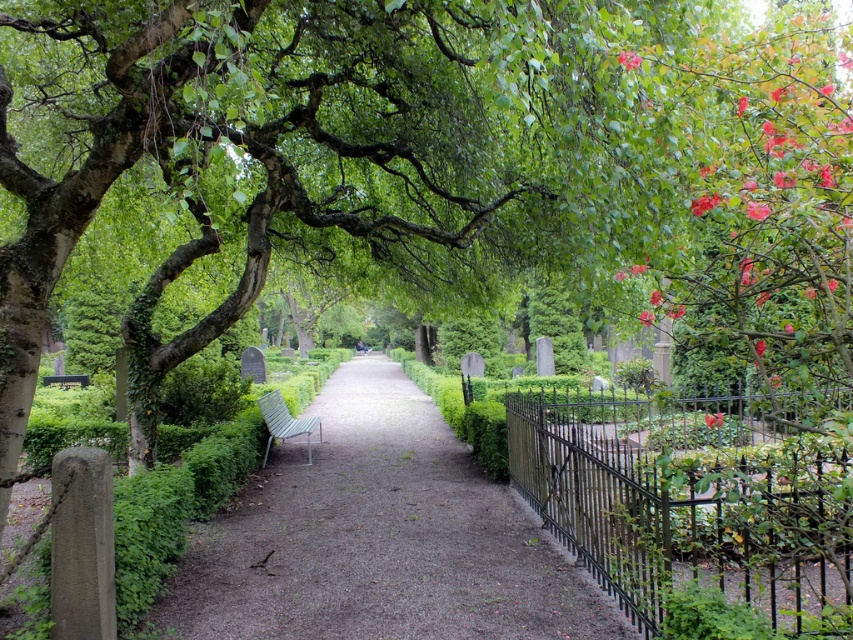
In order to click on green grass at center in this screenshot , I will do `click(380, 538)`.

From the picture: Is green grass at center taller than wooden slats bench at center?

No.

Describe the element at coordinates (380, 538) in the screenshot. Image resolution: width=853 pixels, height=640 pixels. I see `green grass at center` at that location.

Where is `green grass at center`? green grass at center is located at coordinates (380, 538).